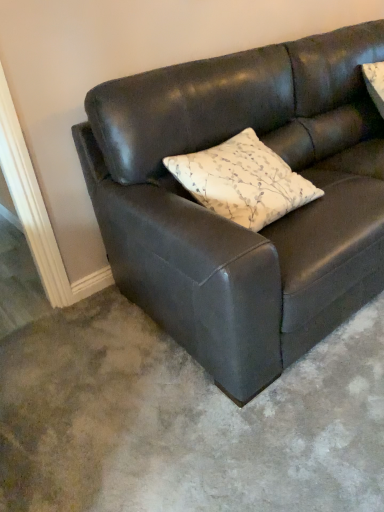
Question: Is matte black couch at center completely or partially inside white floral-patterned pillow at center?

Choices:
 (A) no
 (B) yes

Answer: (A)

Question: From a real-world perspective, does white floral-patterned pillow at center stand above matte black couch at center?

Choices:
 (A) yes
 (B) no

Answer: (A)

Question: From a real-world perspective, is white floral-patterned pillow at center beneath matte black couch at center?

Choices:
 (A) no
 (B) yes

Answer: (A)

Question: From the image's perspective, is white floral-patterned pillow at center located beneath matte black couch at center?

Choices:
 (A) no
 (B) yes

Answer: (B)

Question: Is there a large distance between white floral-patterned pillow at center and matte black couch at center?

Choices:
 (A) yes
 (B) no

Answer: (B)

Question: Considering the relative sizes of white floral-patterned pillow at center and matte black couch at center in the image provided, is white floral-patterned pillow at center shorter than matte black couch at center?

Choices:
 (A) yes
 (B) no

Answer: (A)

Question: From a real-world perspective, is matte black couch at center located higher than white floral-patterned pillow at center?

Choices:
 (A) no
 (B) yes

Answer: (A)

Question: Would you say matte black couch at center is outside white floral-patterned pillow at center?

Choices:
 (A) yes
 (B) no

Answer: (A)

Question: Would you say white floral-patterned pillow at center is part of matte black couch at center's contents?

Choices:
 (A) yes
 (B) no

Answer: (A)

Question: From the image's perspective, is matte black couch at center on white floral-patterned pillow at center?

Choices:
 (A) yes
 (B) no

Answer: (A)

Question: Can you confirm if matte black couch at center is wider than white floral-patterned pillow at center?

Choices:
 (A) yes
 (B) no

Answer: (A)

Question: Does matte black couch at center come in front of white floral-patterned pillow at center?

Choices:
 (A) yes
 (B) no

Answer: (A)

Question: From a real-world perspective, is white floral-patterned pillow at center physically located above or below matte black couch at center?

Choices:
 (A) above
 (B) below

Answer: (A)